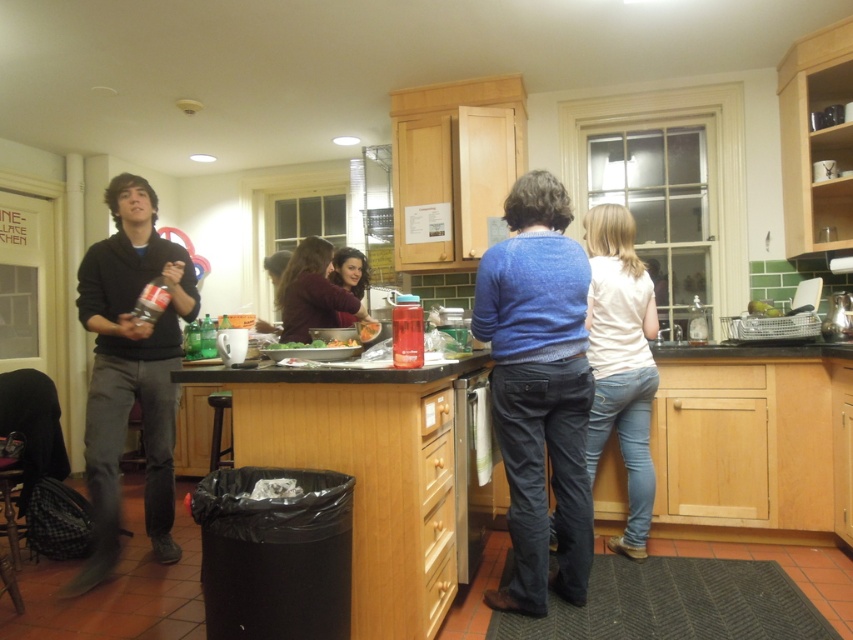
You are organizing a closet and see the dark brown sweater at center and the matte purple sweater at center. Which one is positioned lower?

The dark brown sweater at center is positioned lower because it is below the matte purple sweater at center.

You are organizing items on the kitchen counter and need to place the dark brown sweater at center and the green matte bowl at center side by side. Which object requires more horizontal space?

The dark brown sweater at center requires more horizontal space because its width surpasses that of the green matte bowl at center.